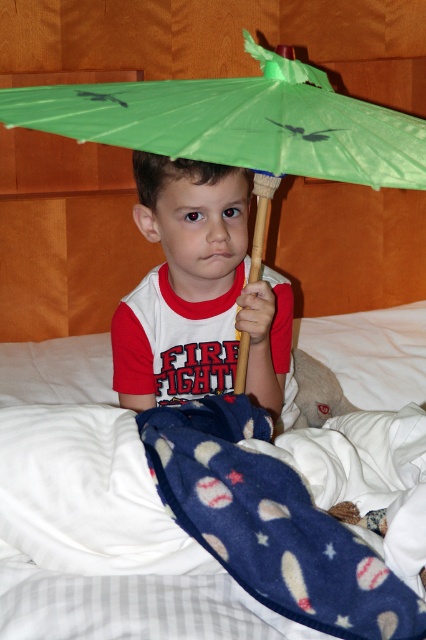
You are a parent trying to cover your child with the white fleece blanket at center and the matte green umbrella at center. Can you place both items so they touch each other without overlapping?

The white fleece blanket at center is 13.17 inches away from the matte green umbrella at center. Since the distance between them is greater than zero, you can place them so they touch each other without overlapping by moving them closer until they are in contact.

You are a parent trying to decide whether to let your child use the matte green umbrella at center to block sunlight while they rest. Considering the size of the white fleece blanket at center, will the umbrella be able to cast a shadow large enough to cover the blanket?

The matte green umbrella at center is taller than the white fleece blanket at center, so it can cast a shadow large enough to cover the blanket.